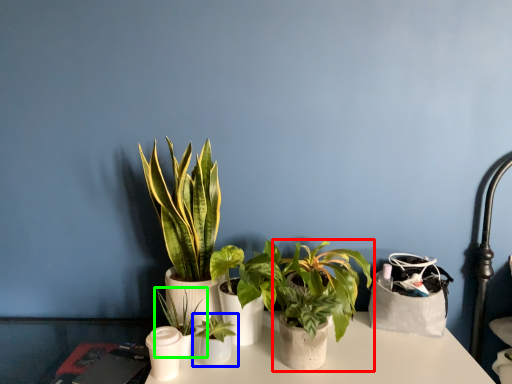
Question: Which object is the closest to the houseplant (highlighted by a red box)? Choose among these: houseplant (highlighted by a blue box) or houseplant (highlighted by a green box).

Choices:
 (A) houseplant
 (B) houseplant

Answer: (A)